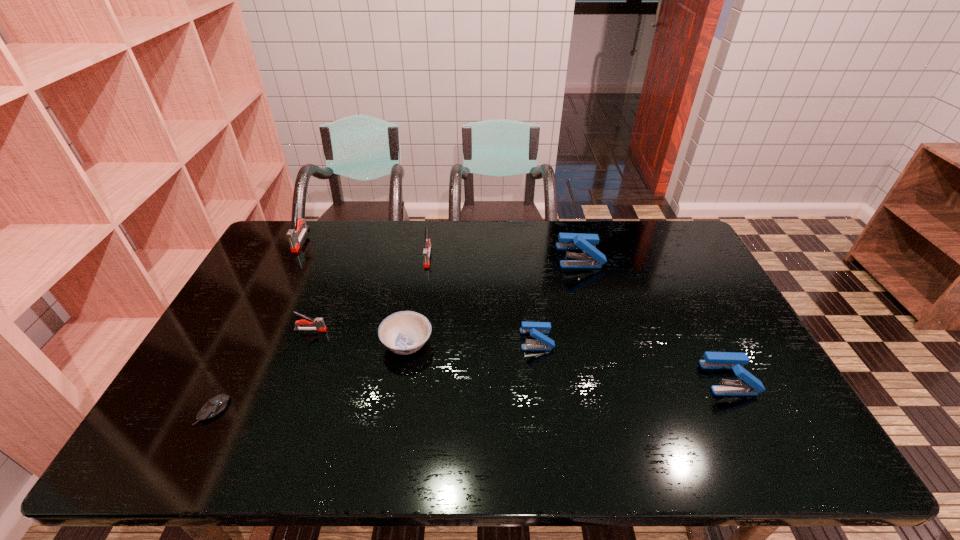
In order to click on free space between the computer mouse and the fourth stapler from left to right in this screenshot , I will do `click(374, 375)`.

The height and width of the screenshot is (540, 960). Find the location of `empty location between the farthest blue stapler and the second biggest gray stapler`. empty location between the farthest blue stapler and the second biggest gray stapler is located at coordinates (504, 256).

Identify which object is located as the fourth nearest to the rightmost object. Please provide its 2D coordinates. Your answer should be formatted as a tuple, i.e. [(x, y)], where the tuple contains the x and y coordinates of a point satisfying the conditions above.

[(427, 243)]

At what (x,y) coordinates should I click in order to perform the action: click on the third closest object to the rightmost stapler. Please return your answer as a coordinate pair (x, y). This screenshot has width=960, height=540. Looking at the image, I should click on 405,332.

Select which stapler appears as the closest to the leftmost gray stapler. Please provide its 2D coordinates. Your answer should be formatted as a tuple, i.e. [(x, y)], where the tuple contains the x and y coordinates of a point satisfying the conditions above.

[(319, 324)]

Find the location of a particular element. stapler that stands as the second closest to the seventh tallest object is located at coordinates (537, 330).

Find the location of `gray stapler that can be found as the second closest to the leftmost stapler`. gray stapler that can be found as the second closest to the leftmost stapler is located at coordinates (427, 243).

Locate an element on the screen. The height and width of the screenshot is (540, 960). gray stapler that is the third closest to the farthest blue stapler is located at coordinates pos(294,240).

Locate an element on the screen. Image resolution: width=960 pixels, height=540 pixels. the closest blue stapler to the computer mouse is located at coordinates (537, 330).

Locate which blue stapler ranks in proximity to the rightmost object. Please provide its 2D coordinates. Your answer should be formatted as a tuple, i.e. [(x, y)], where the tuple contains the x and y coordinates of a point satisfying the conditions above.

[(537, 330)]